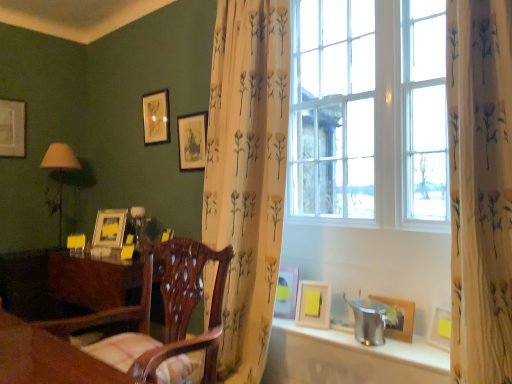
Question: Does metallic silver bucket at lower right contain floral-patterned fabric at center?

Choices:
 (A) yes
 (B) no

Answer: (B)

Question: Considering the relative sizes of metallic silver bucket at lower right and floral-patterned fabric at center in the image provided, is metallic silver bucket at lower right bigger than floral-patterned fabric at center?

Choices:
 (A) no
 (B) yes

Answer: (A)

Question: Can you confirm if metallic silver bucket at lower right is taller than floral-patterned fabric at center?

Choices:
 (A) yes
 (B) no

Answer: (B)

Question: Is metallic silver bucket at lower right facing towards floral-patterned fabric at center?

Choices:
 (A) no
 (B) yes

Answer: (A)

Question: Is metallic silver bucket at lower right turned away from floral-patterned fabric at center?

Choices:
 (A) yes
 (B) no

Answer: (B)

Question: Is metallic silver bucket at lower right placed right next to floral-patterned fabric at center?

Choices:
 (A) no
 (B) yes

Answer: (A)

Question: Is matte beige lamp at left located outside wooden picture frame at lower right, arranged as the 7th picture frame when viewed from the back?

Choices:
 (A) yes
 (B) no

Answer: (A)

Question: Is matte beige lamp at left positioned before wooden picture frame at lower right, marked as the 7th picture frame in a left-to-right arrangement?

Choices:
 (A) yes
 (B) no

Answer: (B)

Question: Is matte beige lamp at left far from wooden picture frame at lower right, marked as the 7th picture frame in a left-to-right arrangement?

Choices:
 (A) yes
 (B) no

Answer: (A)

Question: Is matte beige lamp at left directly adjacent to wooden picture frame at lower right, which ranks as the 1th picture frame in right-to-left order?

Choices:
 (A) no
 (B) yes

Answer: (A)

Question: Is matte beige lamp at left thinner than wooden picture frame at lower right, arranged as the 7th picture frame when viewed from the back?

Choices:
 (A) no
 (B) yes

Answer: (A)

Question: Is matte beige lamp at left wider than wooden picture frame at lower right, which ranks as the 1th picture frame in right-to-left order?

Choices:
 (A) no
 (B) yes

Answer: (B)

Question: Does matte white picture frame at upper right, acting as the second picture frame starting from the front, have a lesser height compared to gold metallic picture frame at left, which is the second picture frame from back to front?

Choices:
 (A) yes
 (B) no

Answer: (A)